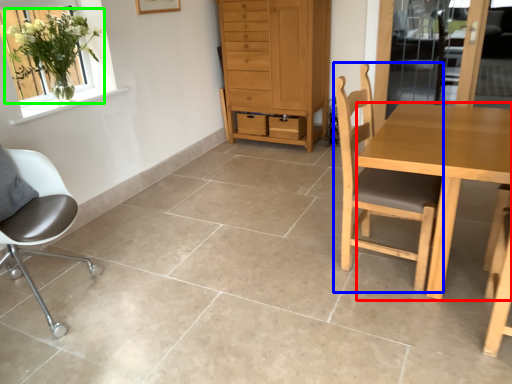
Question: Which is farther away from desk (highlighted by a red box)? chair (highlighted by a blue box) or houseplant (highlighted by a green box)?

Choices:
 (A) chair
 (B) houseplant

Answer: (B)